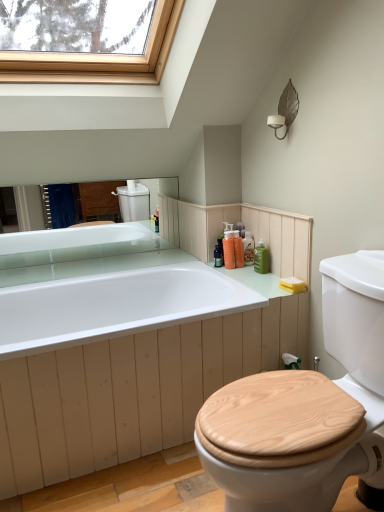
The image size is (384, 512). What do you see at coordinates (248, 248) in the screenshot? I see `orange plastic bottle at upper right, marked as the third toiletry in a left-to-right arrangement` at bounding box center [248, 248].

Describe the element at coordinates (261, 258) in the screenshot. Image resolution: width=384 pixels, height=512 pixels. I see `green plastic bottles at upper right, which ranks as the first toiletry in right-to-left order` at that location.

How much space does green plastic bottles at upper right, which ranks as the first toiletry in right-to-left order, occupy vertically?

6.18 inches.

Identify the location of wooden at right. (306, 410).

What do you see at coordinates (229, 250) in the screenshot? This screenshot has width=384, height=512. I see `translucent plastic bottles at upper right, marked as the 4th toiletry in a right-to-left arrangement` at bounding box center [229, 250].

Identify the location of orange plastic bottle at upper right, marked as the third toiletry in a left-to-right arrangement. (248, 248).

From the image's perspective, is white glossy countertop at upper center located above or below green plastic bottles at upper right, which ranks as the first toiletry in right-to-left order?

From the image's perspective, white glossy countertop at upper center appears below green plastic bottles at upper right, which ranks as the first toiletry in right-to-left order.

Which of these two, white glossy countertop at upper center or green plastic bottles at upper right, which ranks as the first toiletry in right-to-left order, stands shorter?

With less height is green plastic bottles at upper right, which ranks as the first toiletry in right-to-left order.

Does point (43, 255) come behind point (267, 259)?

Yes.

From a real-world perspective, who is located higher, white glossy countertop at upper center or green plastic bottles at upper right, arranged as the fourth toiletry when viewed from the left?

In real-world perspective, green plastic bottles at upper right, arranged as the fourth toiletry when viewed from the left, is above.

Between yellow sponge at right and orange plastic bottle at upper right, which appears as the second toiletry when viewed from the right, which one has smaller size?

yellow sponge at right.

Is yellow sponge at right positioned behind orange plastic bottle at upper right, which appears as the second toiletry when viewed from the right?

No, the depth of yellow sponge at right is less than that of orange plastic bottle at upper right, which appears as the second toiletry when viewed from the right.

Does point (288, 283) come closer to viewer compared to point (245, 247)?

Yes, point (288, 283) is closer to viewer.

Considering the positions of objects translucent orange soap at upper right, which is counted as the 3th toiletry, starting from the right, and orange plastic bottle at upper right, which appears as the second toiletry when viewed from the right, in the image provided, who is behind, translucent orange soap at upper right, which is counted as the 3th toiletry, starting from the right, or orange plastic bottle at upper right, which appears as the second toiletry when viewed from the right,?

Positioned behind is orange plastic bottle at upper right, which appears as the second toiletry when viewed from the right.

Are translucent orange soap at upper right, positioned as the 2th toiletry in left-to-right order, and orange plastic bottle at upper right, which appears as the second toiletry when viewed from the right, located far from each other?

No.

Between translucent orange soap at upper right, which is counted as the 3th toiletry, starting from the right, and orange plastic bottle at upper right, which appears as the second toiletry when viewed from the right, which one appears on the right side from the viewer's perspective?

orange plastic bottle at upper right, which appears as the second toiletry when viewed from the right.

Is point (63, 391) closer to camera compared to point (227, 241)?

Yes, it is in front of point (227, 241).

From the white glossy countertop at upper center, count 2nd toiletrys backward and point to it. Please provide its 2D coordinates.

[(229, 250)]

Based on the photo, between white glossy countertop at upper center and translucent plastic bottles at upper right, marked as the 4th toiletry in a right-to-left arrangement, which one appears on the left side from the viewer's perspective?

white glossy countertop at upper center is more to the left.

Considering the sizes of objects green plastic bottles at upper right, which ranks as the first toiletry in right-to-left order, and translucent plastic bottles at upper right, the first toiletry from the left, in the image provided, who is wider, green plastic bottles at upper right, which ranks as the first toiletry in right-to-left order, or translucent plastic bottles at upper right, the first toiletry from the left,?

Wider between the two is translucent plastic bottles at upper right, the first toiletry from the left.

Which object is closer to the camera taking this photo, green plastic bottles at upper right, arranged as the fourth toiletry when viewed from the left, or translucent plastic bottles at upper right, the first toiletry from the left?

green plastic bottles at upper right, arranged as the fourth toiletry when viewed from the left, is more forward.

Based on the photo, is green plastic bottles at upper right, arranged as the fourth toiletry when viewed from the left, at the left side of translucent plastic bottles at upper right, marked as the 4th toiletry in a right-to-left arrangement?

Incorrect, green plastic bottles at upper right, arranged as the fourth toiletry when viewed from the left, is not on the left side of translucent plastic bottles at upper right, marked as the 4th toiletry in a right-to-left arrangement.

Consider the image. From a real-world perspective, is green plastic bottles at upper right, arranged as the fourth toiletry when viewed from the left, physically above translucent plastic bottles at upper right, marked as the 4th toiletry in a right-to-left arrangement?

Actually, green plastic bottles at upper right, arranged as the fourth toiletry when viewed from the left, is physically below translucent plastic bottles at upper right, marked as the 4th toiletry in a right-to-left arrangement, in the real world.

Is green plastic bottles at upper right, which ranks as the first toiletry in right-to-left order, surrounding wooden at right?

That's incorrect, wooden at right is not inside green plastic bottles at upper right, which ranks as the first toiletry in right-to-left order.

Considering the relative positions of green plastic bottles at upper right, arranged as the fourth toiletry when viewed from the left, and wooden at right in the image provided, is green plastic bottles at upper right, arranged as the fourth toiletry when viewed from the left, behind wooden at right?

Yes, the depth of green plastic bottles at upper right, arranged as the fourth toiletry when viewed from the left, is greater than that of wooden at right.

In the scene shown: Between green plastic bottles at upper right, arranged as the fourth toiletry when viewed from the left, and wooden at right, which one has smaller size?

With smaller size is green plastic bottles at upper right, arranged as the fourth toiletry when viewed from the left.

From the picture: From the image's perspective, is green plastic bottles at upper right, which ranks as the first toiletry in right-to-left order, above wooden at right?

Indeed, from the image's perspective, green plastic bottles at upper right, which ranks as the first toiletry in right-to-left order, is shown above wooden at right.

How distant is translucent plastic bottles at upper right, marked as the 4th toiletry in a right-to-left arrangement, from wooden at right?

The distance of translucent plastic bottles at upper right, marked as the 4th toiletry in a right-to-left arrangement, from wooden at right is 38.62 inches.

Is the depth of translucent plastic bottles at upper right, the first toiletry from the left, less than that of wooden at right?

No.

Between translucent plastic bottles at upper right, the first toiletry from the left, and wooden at right, which one has smaller width?

translucent plastic bottles at upper right, the first toiletry from the left.

Can you confirm if translucent plastic bottles at upper right, marked as the 4th toiletry in a right-to-left arrangement, is smaller than wooden at right?

Indeed, translucent plastic bottles at upper right, marked as the 4th toiletry in a right-to-left arrangement, has a smaller size compared to wooden at right.

Identify the location of counter top below the green plastic bottles at upper right, which ranks as the first toiletry in right-to-left order (from the image's perspective). This screenshot has height=512, width=384. (125, 349).

From the yellow sponge at right, count the 2nd toiletry to the left and point to it. Please provide its 2D coordinates.

[(248, 248)]

Which object lies further to the anchor point orange plastic bottle at upper right, marked as the third toiletry in a left-to-right arrangement, yellow sponge at right or wooden at right?

wooden at right lies further to orange plastic bottle at upper right, marked as the third toiletry in a left-to-right arrangement, than the other object.

In the scene shown: Estimate the real-world distances between objects in this image. Which object is closer to translucent plastic bottles at upper right, marked as the 4th toiletry in a right-to-left arrangement, wooden at right or yellow sponge at right?

yellow sponge at right.

In the scene shown: Based on their spatial positions, is green plastic bottles at upper right, arranged as the fourth toiletry when viewed from the left, or white glossy countertop at upper center further from orange plastic bottle at upper right, which appears as the second toiletry when viewed from the right?

white glossy countertop at upper center lies further to orange plastic bottle at upper right, which appears as the second toiletry when viewed from the right, than the other object.

Which object lies further to the anchor point white glossy countertop at upper center, orange plastic bottle at upper right, which appears as the second toiletry when viewed from the right, or green plastic bottles at upper right, arranged as the fourth toiletry when viewed from the left?

orange plastic bottle at upper right, which appears as the second toiletry when viewed from the right, is positioned further to the anchor white glossy countertop at upper center.

From the picture: Considering their positions, is wooden at right positioned further to white glossy countertop at upper center than yellow sponge at right?

Based on the image, yellow sponge at right appears to be further to white glossy countertop at upper center.

Estimate the real-world distances between objects in this image. Which object is further from wooden at right, orange plastic bottle at upper right, which appears as the second toiletry when viewed from the right, or white glossy countertop at upper center?

The object further to wooden at right is orange plastic bottle at upper right, which appears as the second toiletry when viewed from the right.

Looking at the image, which one is located closer to white glossy countertop at upper center, translucent plastic bottles at upper right, the first toiletry from the left, or orange plastic bottle at upper right, which appears as the second toiletry when viewed from the right?

The object closer to white glossy countertop at upper center is translucent plastic bottles at upper right, the first toiletry from the left.

Based on their spatial positions, is white glossy countertop at upper center or wooden at right closer to translucent orange soap at upper right, which is counted as the 3th toiletry, starting from the right?

white glossy countertop at upper center is positioned closer to the anchor translucent orange soap at upper right, which is counted as the 3th toiletry, starting from the right.

This screenshot has width=384, height=512. What are the coordinates of `counter top between wooden at right and orange plastic bottle at upper right, marked as the third toiletry in a left-to-right arrangement, in the front-back direction` in the screenshot? It's located at (125, 349).

At what (x,y) coordinates should I click in order to perform the action: click on soap between white glossy countertop at upper center and translucent orange soap at upper right, positioned as the 2th toiletry in left-to-right order, from front to back. Please return your answer as a coordinate pair (x, y). The height and width of the screenshot is (512, 384). Looking at the image, I should click on (292, 284).

Identify the location of soap between wooden at right and translucent orange soap at upper right, positioned as the 2th toiletry in left-to-right order, in the front-back direction. This screenshot has width=384, height=512. (292, 284).

Identify the location of toiletry between yellow sponge at right and translucent plastic bottles at upper right, the first toiletry from the left, from front to back. The width and height of the screenshot is (384, 512). (261, 258).